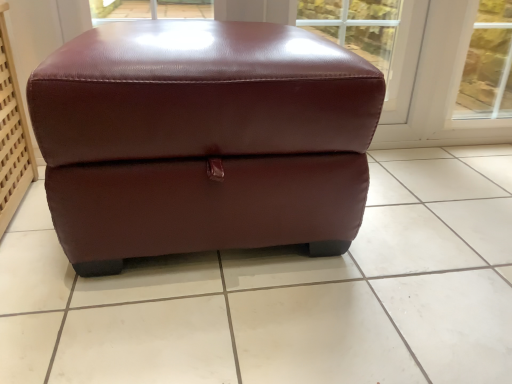
At what (x,y) coordinates should I click in order to perform the action: click on vacant space in front of burgundy leather ottoman at center. Please return your answer as a coordinate pair (x, y). The width and height of the screenshot is (512, 384). Looking at the image, I should click on (220, 319).